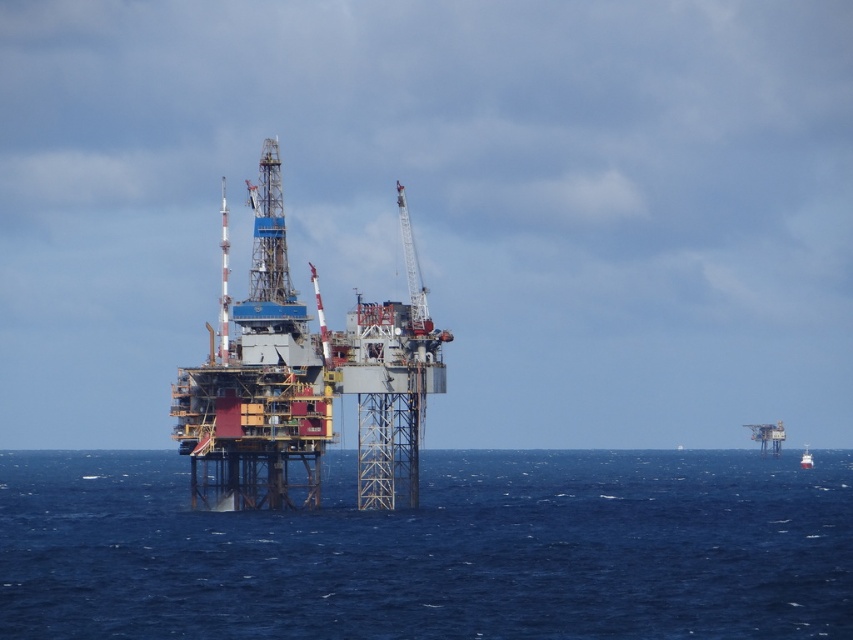
Question: Does blue water at center have a greater width compared to red glossy boat at far right?

Choices:
 (A) no
 (B) yes

Answer: (B)

Question: Among these objects, which one is nearest to the camera?

Choices:
 (A) blue water at center
 (B) red glossy boat at far right

Answer: (A)

Question: Is blue water at center to the left of red glossy boat at far right from the viewer's perspective?

Choices:
 (A) yes
 (B) no

Answer: (A)

Question: Which of the following is the farthest from the observer?

Choices:
 (A) blue water at center
 (B) red glossy boat at far right

Answer: (B)

Question: Where is blue water at center located in relation to red glossy boat at far right in the image?

Choices:
 (A) left
 (B) right

Answer: (A)